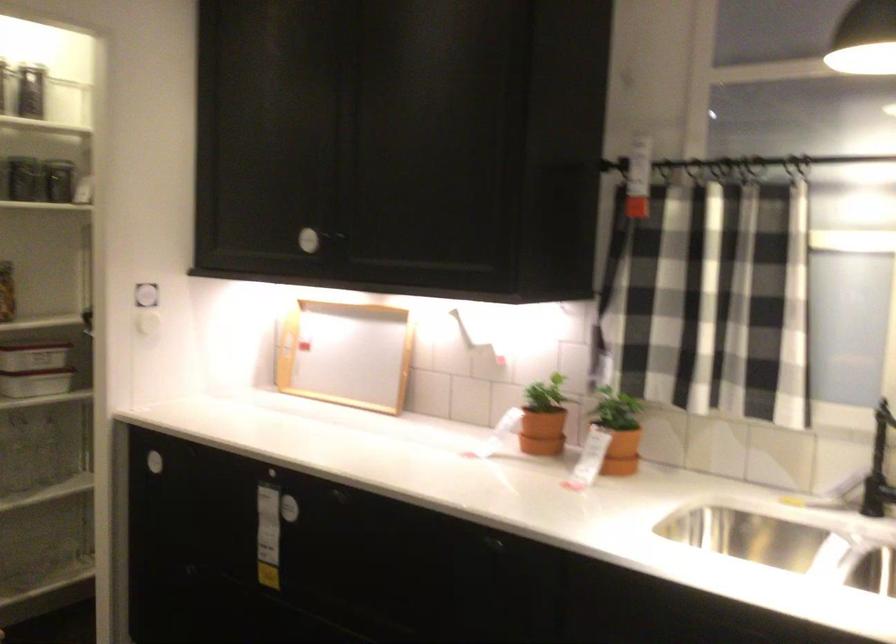
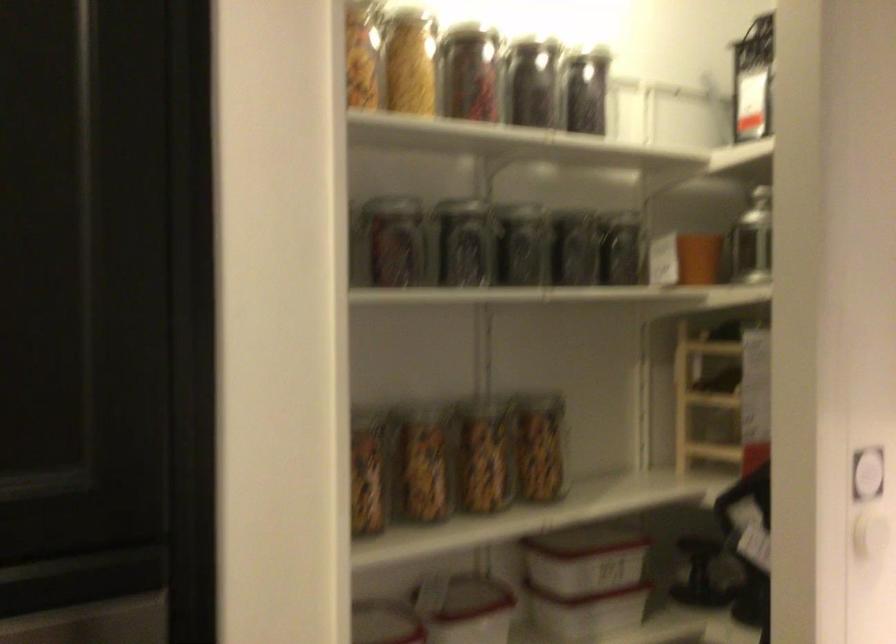
Locate, in the second image, the point that corresponds to pixel 145 297 in the first image.

(867, 474)